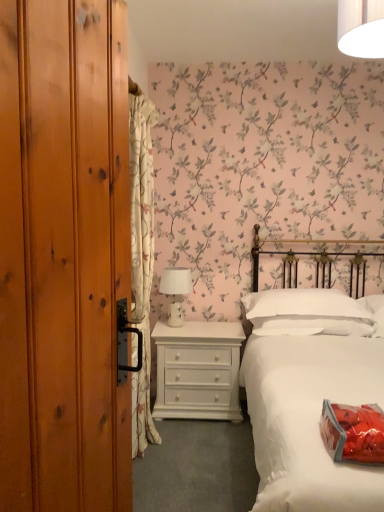
Question: Considering the relative sizes of white ceramic table lamp at center and white soft pillow at center in the image provided, is white ceramic table lamp at center shorter than white soft pillow at center?

Choices:
 (A) yes
 (B) no

Answer: (B)

Question: Does white ceramic table lamp at center turn towards white soft pillow at center?

Choices:
 (A) yes
 (B) no

Answer: (B)

Question: Is white ceramic table lamp at center beside white soft pillow at center?

Choices:
 (A) yes
 (B) no

Answer: (B)

Question: Considering the relative sizes of white ceramic table lamp at center and white soft pillow at center in the image provided, is white ceramic table lamp at center wider than white soft pillow at center?

Choices:
 (A) no
 (B) yes

Answer: (A)

Question: Does white ceramic table lamp at center have a lesser width compared to white soft pillow at center?

Choices:
 (A) yes
 (B) no

Answer: (A)

Question: Considering the positions of point (223, 376) and point (135, 402), is point (223, 376) closer or farther from the camera than point (135, 402)?

Choices:
 (A) farther
 (B) closer

Answer: (A)

Question: In terms of size, does white painted wood chest of drawers at center appear bigger or smaller than white floral fabric curtain at left?

Choices:
 (A) small
 (B) big

Answer: (A)

Question: In terms of width, does white painted wood chest of drawers at center look wider or thinner when compared to white floral fabric curtain at left?

Choices:
 (A) wide
 (B) thin

Answer: (A)

Question: From a real-world perspective, is white painted wood chest of drawers at center above or below white floral fabric curtain at left?

Choices:
 (A) below
 (B) above

Answer: (A)

Question: Do you think white floral fabric curtain at left is within white painted wood chest of drawers at center, or outside of it?

Choices:
 (A) outside
 (B) inside

Answer: (A)

Question: Is white floral fabric curtain at left wider or thinner than white painted wood chest of drawers at center?

Choices:
 (A) wide
 (B) thin

Answer: (B)

Question: Is white floral fabric curtain at left taller or shorter than white painted wood chest of drawers at center?

Choices:
 (A) tall
 (B) short

Answer: (A)

Question: Considering their positions, is white floral fabric curtain at left located in front of or behind white painted wood chest of drawers at center?

Choices:
 (A) front
 (B) behind

Answer: (A)

Question: Does point (296, 271) appear closer or farther from the camera than point (188, 281)?

Choices:
 (A) closer
 (B) farther

Answer: (A)

Question: In terms of height, does white cotton bed at center look taller or shorter compared to white ceramic table lamp at center?

Choices:
 (A) short
 (B) tall

Answer: (B)